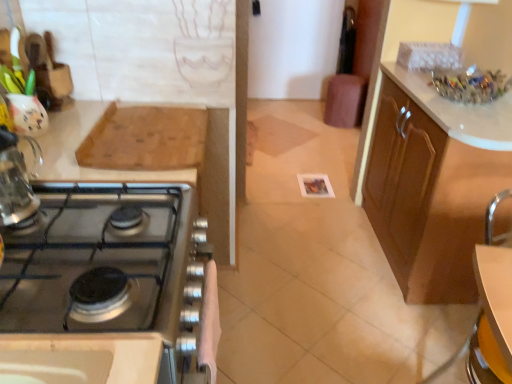
Question: Is wooden cutting board at upper left behind brown wood cabinet at right, positioned as the 2th cabinetry in front-to-back order?

Choices:
 (A) yes
 (B) no

Answer: (B)

Question: Can you confirm if wooden cutting board at upper left is smaller than brown wood cabinet at right, positioned as the 2th cabinetry in front-to-back order?

Choices:
 (A) no
 (B) yes

Answer: (B)

Question: Is wooden cutting board at upper left far from brown wood cabinet at right, positioned as the 2th cabinetry in front-to-back order?

Choices:
 (A) no
 (B) yes

Answer: (B)

Question: Does wooden cutting board at upper left have a lesser height compared to brown wood cabinet at right, positioned as the 2th cabinetry in front-to-back order?

Choices:
 (A) yes
 (B) no

Answer: (A)

Question: Does wooden cutting board at upper left turn towards brown wood cabinet at right, the second cabinetry when ordered from left to right?

Choices:
 (A) no
 (B) yes

Answer: (A)

Question: From the image's perspective, is clear glass kettle at left positioned above or below satin silver stove at left, which is counted as the 2th cabinetry, starting from the back?

Choices:
 (A) above
 (B) below

Answer: (A)

Question: Do you think clear glass kettle at left is within satin silver stove at left, the second cabinetry positioned from the right, or outside of it?

Choices:
 (A) outside
 (B) inside

Answer: (A)

Question: Considering the positions of clear glass kettle at left and satin silver stove at left, the first cabinetry positioned from the left, in the image, is clear glass kettle at left bigger or smaller than satin silver stove at left, the first cabinetry positioned from the left,?

Choices:
 (A) small
 (B) big

Answer: (A)

Question: Is point (x=19, y=203) closer or farther from the camera than point (x=31, y=226)?

Choices:
 (A) closer
 (B) farther

Answer: (A)

Question: Considering the positions of brown wood cabinet at right, marked as the first cabinetry in a right-to-left arrangement, and satin silver stove at left, the second cabinetry positioned from the right, in the image, is brown wood cabinet at right, marked as the first cabinetry in a right-to-left arrangement, bigger or smaller than satin silver stove at left, the second cabinetry positioned from the right,?

Choices:
 (A) small
 (B) big

Answer: (B)

Question: From a real-world perspective, is brown wood cabinet at right, which ranks as the first cabinetry in back-to-front order, above or below satin silver stove at left, which is counted as the 2th cabinetry, starting from the back?

Choices:
 (A) below
 (B) above

Answer: (A)

Question: Looking at their shapes, would you say brown wood cabinet at right, which ranks as the first cabinetry in back-to-front order, is wider or thinner than satin silver stove at left, the first cabinetry positioned from the left?

Choices:
 (A) thin
 (B) wide

Answer: (A)

Question: From the image's perspective, is brown wood cabinet at right, which ranks as the first cabinetry in back-to-front order, positioned above or below satin silver stove at left, which is counted as the 2th cabinetry, starting from the back?

Choices:
 (A) above
 (B) below

Answer: (A)

Question: From a real-world perspective, is brown leather bar stool at center positioned above or below satin silver stove at left, the first cabinetry positioned from the left?

Choices:
 (A) below
 (B) above

Answer: (A)

Question: From the image's perspective, is brown leather bar stool at center above or below satin silver stove at left, which is counted as the 2th cabinetry, starting from the back?

Choices:
 (A) below
 (B) above

Answer: (B)